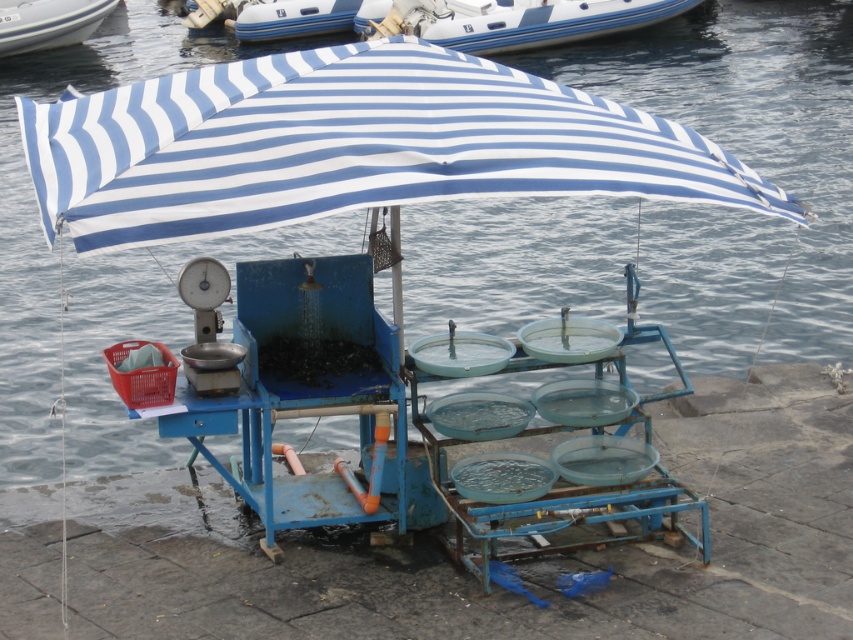
Question: Is blue rubber boat at upper center to the left of white glossy boat at upper left from the viewer's perspective?

Choices:
 (A) yes
 (B) no

Answer: (B)

Question: Which object appears closest to the camera in this image?

Choices:
 (A) blue rubber boat at upper center
 (B) white glossy boat at upper left

Answer: (A)

Question: Which point is closer to the camera?

Choices:
 (A) (70, 17)
 (B) (392, 6)

Answer: (B)

Question: Is blue rubber boat at upper center smaller than white glossy boat at upper left?

Choices:
 (A) yes
 (B) no

Answer: (B)

Question: Which point is closer to the camera taking this photo?

Choices:
 (A) (51, 44)
 (B) (509, 8)

Answer: (B)

Question: Considering the relative positions of blue rubber boat at upper center and white glossy boat at upper left in the image provided, where is blue rubber boat at upper center located with respect to white glossy boat at upper left?

Choices:
 (A) above
 (B) below

Answer: (B)